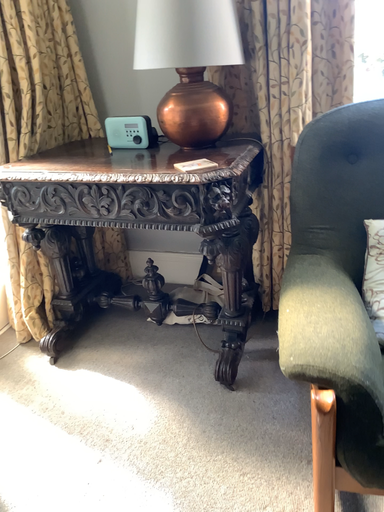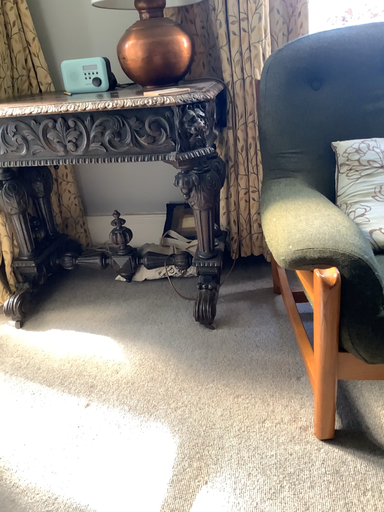
Question: How did the camera likely rotate when shooting the video?

Choices:
 (A) rotated right
 (B) rotated left

Answer: (A)